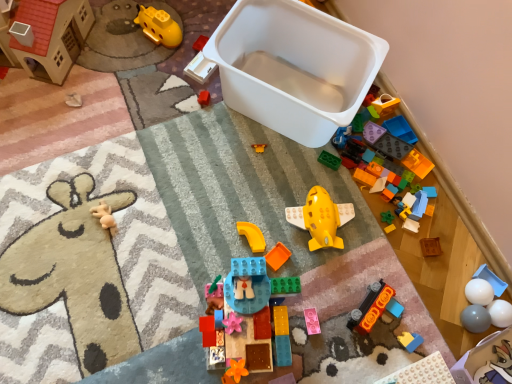
You are a GUI agent. You are given a task and a screenshot of the screen. Output one action in this format:
    pyautogui.click(x=<x>, y=<y>)
    Task: Click on the vacant area that lies to the right of translucent blue plastic building block at center, the 12th toy from the right
    Image resolution: width=512 pixels, height=384 pixels.
    Given the screenshot: What is the action you would take?
    pyautogui.click(x=326, y=329)